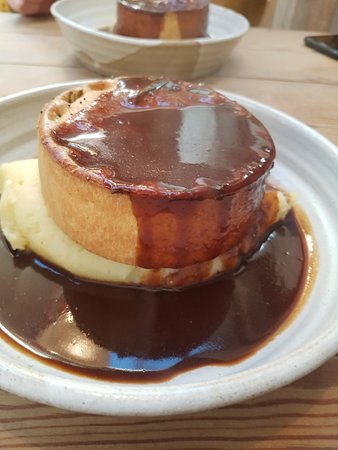
Where is `white bowl`? white bowl is located at coordinates (210, 51).